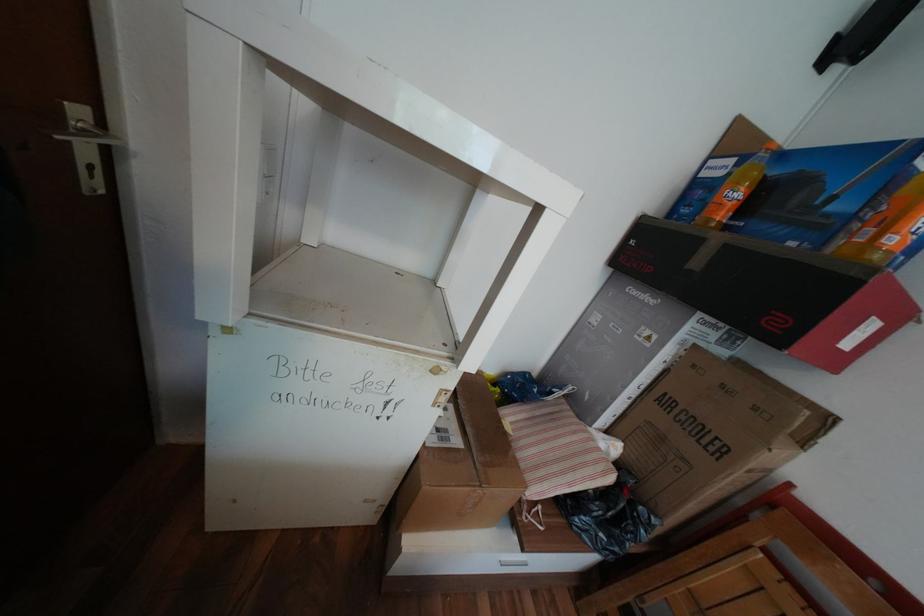
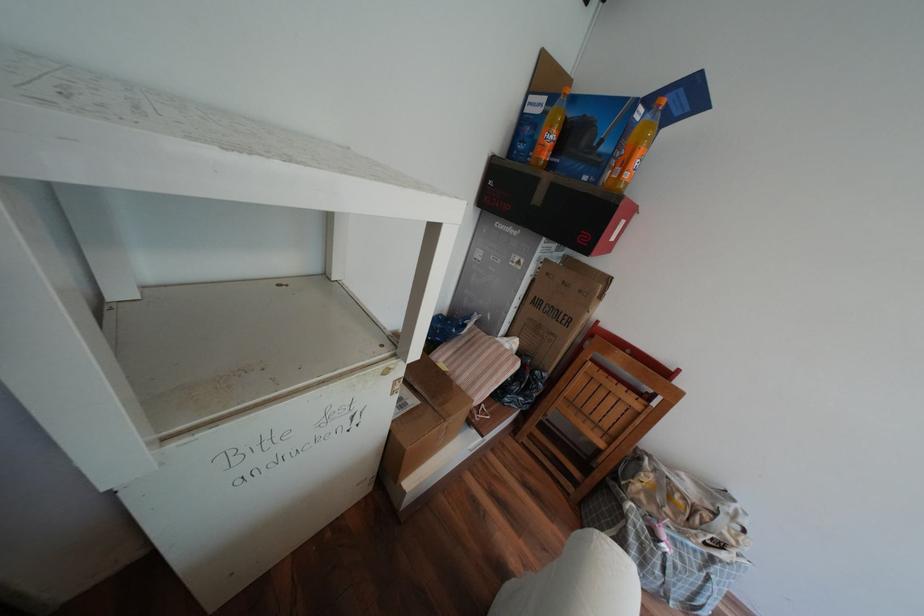
Locate, in the second image, the point that corresponds to point 604,462 in the first image.

(517, 360)